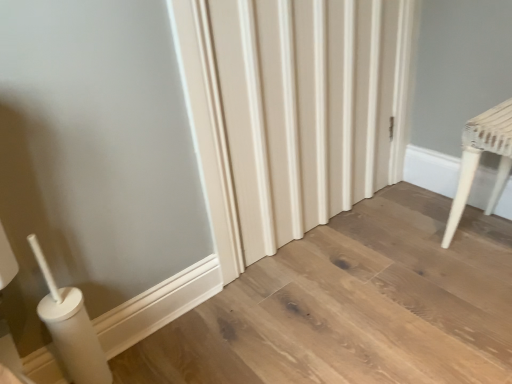
Question: Considering the positions of white textured radiator at center and white woven stool at right in the image, is white textured radiator at center taller or shorter than white woven stool at right?

Choices:
 (A) short
 (B) tall

Answer: (B)

Question: Relative to white woven stool at right, is white textured radiator at center in front or behind?

Choices:
 (A) front
 (B) behind

Answer: (A)

Question: From the image's perspective, relative to white woven stool at right, is white textured radiator at center above or below?

Choices:
 (A) below
 (B) above

Answer: (B)

Question: Is white woven stool at right inside or outside of white textured radiator at center?

Choices:
 (A) inside
 (B) outside

Answer: (B)

Question: From the image's perspective, is white woven stool at right above or below white textured radiator at center?

Choices:
 (A) above
 (B) below

Answer: (B)

Question: Considering the positions of white woven stool at right and white textured radiator at center in the image, is white woven stool at right wider or thinner than white textured radiator at center?

Choices:
 (A) wide
 (B) thin

Answer: (A)

Question: From a real-world perspective, is white woven stool at right above or below white textured radiator at center?

Choices:
 (A) below
 (B) above

Answer: (A)